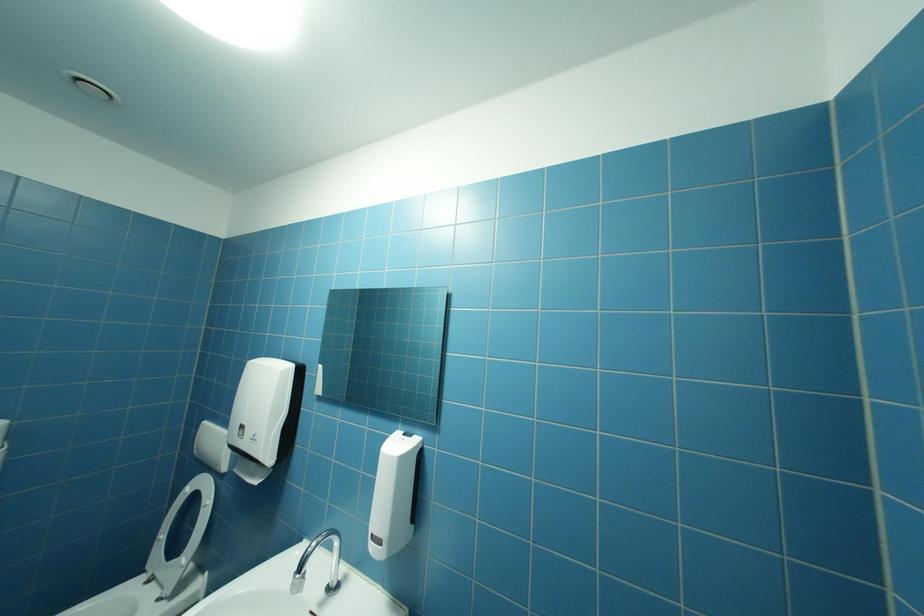
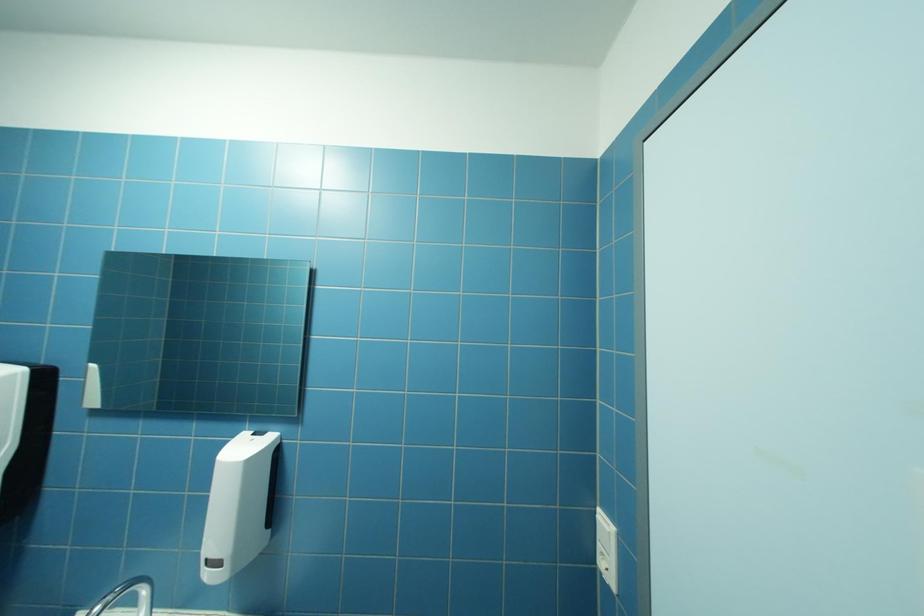
Question: The camera is either moving clockwise (left) or counter-clockwise (right) around the object. The first image is from the beginning of the video and the second image is from the end. Is the camera moving left or right when shooting the video?

Choices:
 (A) Left
 (B) Right

Answer: (A)